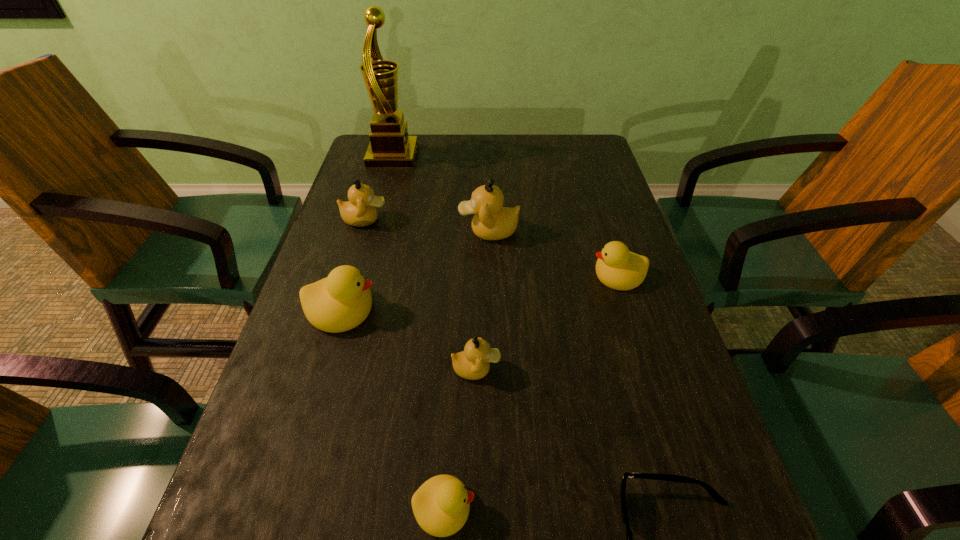
Locate an element on the screen. the farthest object is located at coordinates (390, 147).

Where is `gold award`? gold award is located at coordinates (390, 147).

What are the coordinates of `the second tallest object` in the screenshot? It's located at (491, 221).

The width and height of the screenshot is (960, 540). In order to click on the biggest tan duckling in this screenshot , I will do `click(491, 221)`.

You are a GUI agent. You are given a task and a screenshot of the screen. Output one action in this format:
    pyautogui.click(x=<x>, y=<y>)
    Task: Click on the second smallest tan duckling
    
    Given the screenshot: What is the action you would take?
    pyautogui.click(x=360, y=210)

Locate an element on the screen. This screenshot has height=540, width=960. the biggest yellow duckling is located at coordinates (340, 302).

Locate an element on the screen. The height and width of the screenshot is (540, 960). the second biggest yellow duckling is located at coordinates (618, 268).

Identify the location of the rightmost duckling. (618, 268).

This screenshot has width=960, height=540. What are the coordinates of `the sixth farthest object` in the screenshot? It's located at (473, 363).

What are the coordinates of `the smallest tan duckling` in the screenshot? It's located at (473, 363).